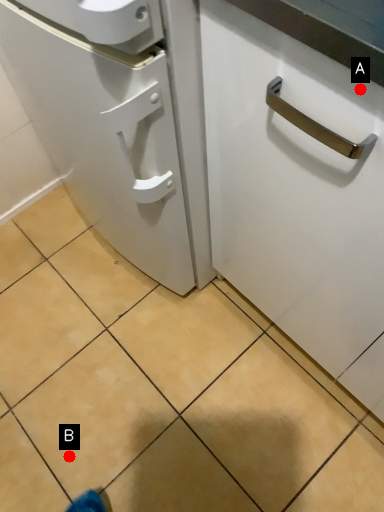
Question: Two points are circled on the image, labeled by A and B beside each circle. Among these points, which one is nearest to the camera?

Choices:
 (A) A is closer
 (B) B is closer

Answer: (A)